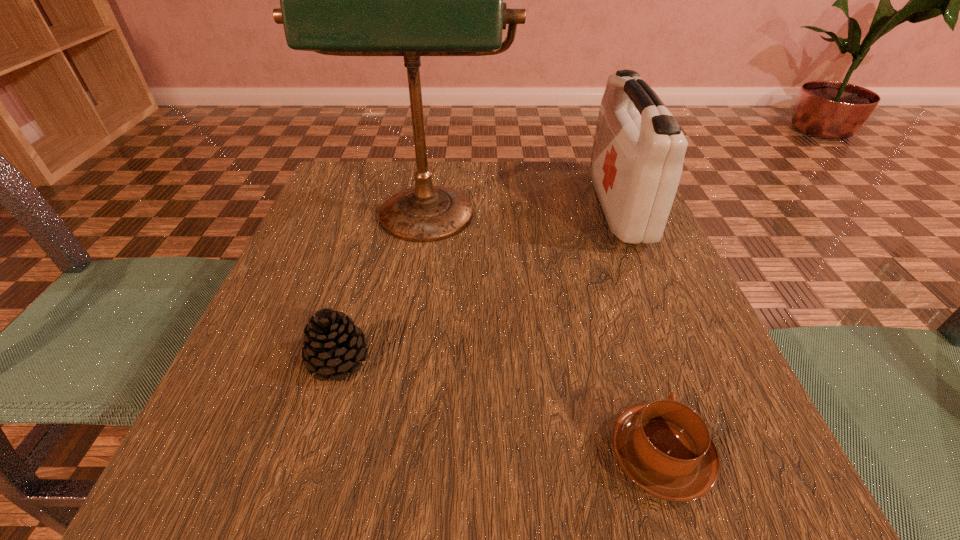
Image resolution: width=960 pixels, height=540 pixels. Find the location of `cappuccino positioned at the right edge`. cappuccino positioned at the right edge is located at coordinates (664, 447).

Where is `object that is at the far left corner`? The width and height of the screenshot is (960, 540). object that is at the far left corner is located at coordinates (411, 0).

Image resolution: width=960 pixels, height=540 pixels. Find the location of `object positioned at the far right corner`. object positioned at the far right corner is located at coordinates pyautogui.click(x=637, y=159).

Locate an element on the screen. object that is at the near right corner is located at coordinates (664, 447).

In the image, there is a desktop. In order to click on vacant space at the far edge in this screenshot , I will do `click(468, 164)`.

Image resolution: width=960 pixels, height=540 pixels. Find the location of `free location at the left edge`. free location at the left edge is located at coordinates pyautogui.click(x=273, y=315).

Where is `vacant region at the right edge of the desktop`? vacant region at the right edge of the desktop is located at coordinates (690, 384).

This screenshot has width=960, height=540. In the image, there is a desktop. What are the coordinates of `vacant space at the far left corner` in the screenshot? It's located at (388, 176).

I want to click on free space at the near left corner of the desktop, so click(206, 500).

This screenshot has width=960, height=540. In order to click on vacant point at the far right corner in this screenshot , I will do 586,207.